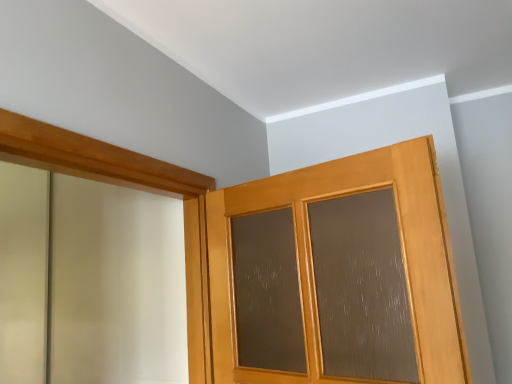
Describe the element at coordinates (132, 188) in the screenshot. I see `wooden barn door at upper left` at that location.

Where is `wooden barn door at upper left`? This screenshot has width=512, height=384. wooden barn door at upper left is located at coordinates (132, 188).

What do you see at coordinates (310, 256) in the screenshot?
I see `matte wood door at center` at bounding box center [310, 256].

Locate an element on the screen. This screenshot has height=384, width=512. matte wood door at center is located at coordinates (310, 256).

Find the location of a particular element. The height and width of the screenshot is (384, 512). wooden barn door at upper left is located at coordinates (132, 188).

In the image, is wooden barn door at upper left on the left side or the right side of matte wood door at center?

In the image, wooden barn door at upper left appears on the left side of matte wood door at center.

Which object is closer to the camera, wooden barn door at upper left or matte wood door at center?

wooden barn door at upper left is in front.

Does point (21, 148) come behind point (227, 357)?

No, (21, 148) is in front of (227, 357).

From the image's perspective, is wooden barn door at upper left above or below matte wood door at center?

wooden barn door at upper left is situated higher than matte wood door at center in the image.

From a real-world perspective, is wooden barn door at upper left positioned above or below matte wood door at center?

Clearly, from a real-world perspective, wooden barn door at upper left is above matte wood door at center.

Looking at their sizes, would you say wooden barn door at upper left is wider or thinner than matte wood door at center?

In the image, wooden barn door at upper left appears to be more narrow than matte wood door at center.

Which of these two, wooden barn door at upper left or matte wood door at center, stands shorter?

Standing shorter between the two is matte wood door at center.

Which of these two, wooden barn door at upper left or matte wood door at center, is bigger?

With larger size is matte wood door at center.

Would you say wooden barn door at upper left is outside matte wood door at center?

Yes, wooden barn door at upper left is not within matte wood door at center.

Does wooden barn door at upper left touch matte wood door at center?

wooden barn door at upper left and matte wood door at center are clearly separated.

Is wooden barn door at upper left facing towards matte wood door at center?

Yes, wooden barn door at upper left is turned towards matte wood door at center.

Measure the distance from wooden barn door at upper left to matte wood door at center.

A distance of 39.76 centimeters exists between wooden barn door at upper left and matte wood door at center.

The width and height of the screenshot is (512, 384). Identify the location of door below the wooden barn door at upper left (from the image's perspective). (310, 256).

Considering the relative positions of matte wood door at center and wooden barn door at upper left in the image provided, is matte wood door at center to the right of wooden barn door at upper left from the viewer's perspective?

Yes.

In the image, is matte wood door at center positioned in front of or behind wooden barn door at upper left?

In the image, matte wood door at center appears behind wooden barn door at upper left.

Is point (405, 259) positioned before point (192, 215)?

Yes.

From the image's perspective, is matte wood door at center below wooden barn door at upper left?

Yes, from the image's perspective, matte wood door at center is below wooden barn door at upper left.

From a real-world perspective, between matte wood door at center and wooden barn door at upper left, who is vertically lower?

matte wood door at center, from a real-world perspective.

Considering the sizes of matte wood door at center and wooden barn door at upper left in the image, is matte wood door at center wider or thinner than wooden barn door at upper left?

Clearly, matte wood door at center has more width compared to wooden barn door at upper left.

From their relative heights in the image, would you say matte wood door at center is taller or shorter than wooden barn door at upper left?

Clearly, matte wood door at center is shorter compared to wooden barn door at upper left.

In terms of size, does matte wood door at center appear bigger or smaller than wooden barn door at upper left?

Considering their sizes, matte wood door at center takes up more space than wooden barn door at upper left.

Is matte wood door at center inside the boundaries of wooden barn door at upper left, or outside?

matte wood door at center exists outside the volume of wooden barn door at upper left.

Is matte wood door at center beside wooden barn door at upper left?

No.

Is matte wood door at center oriented away from wooden barn door at upper left?

That's not correct — matte wood door at center is not looking away from wooden barn door at upper left.

Can you tell me how much matte wood door at center and wooden barn door at upper left differ in facing direction?

There is a 103-degree angle between the facing directions of matte wood door at center and wooden barn door at upper left.

How much distance is there between matte wood door at center and wooden barn door at upper left?

15.65 inches.

The image size is (512, 384). Identify the location of barn door above the matte wood door at center (from the image's perspective). (132, 188).

At what (x,y) coordinates should I click in order to perform the action: click on door behind the wooden barn door at upper left. Please return your answer as a coordinate pair (x, y). This screenshot has height=384, width=512. Looking at the image, I should click on (310, 256).

Where is `barn door above the matte wood door at center (from a real-world perspective)`? The height and width of the screenshot is (384, 512). barn door above the matte wood door at center (from a real-world perspective) is located at coordinates (132, 188).